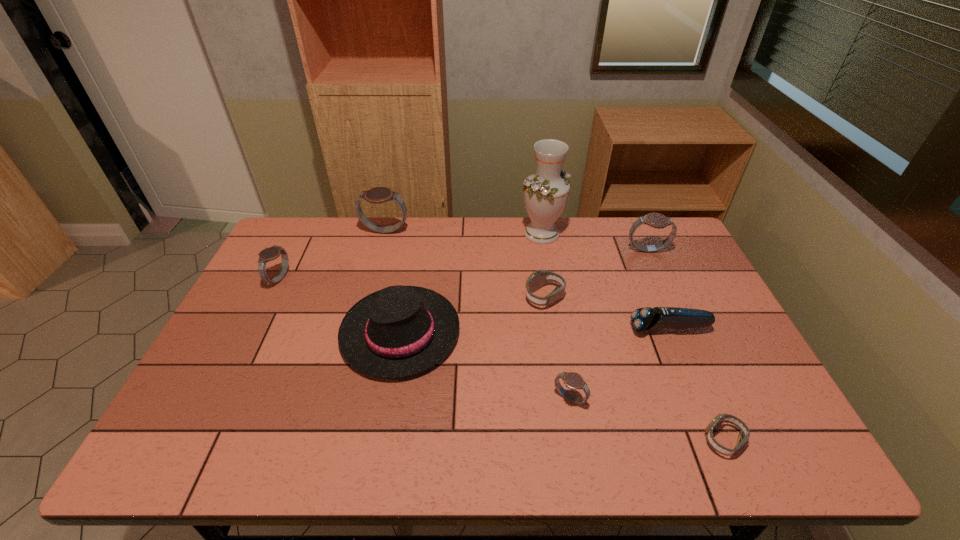
Find the location of `electric shaver`. electric shaver is located at coordinates (243, 412).

In order to click on the second nearest object in this screenshot , I will do `click(243, 412)`.

Locate an element on the screen. Image resolution: width=960 pixels, height=540 pixels. the fifth farthest watch is located at coordinates (243, 412).

At what (x,y) coordinates should I click in order to perform the action: click on the nearer white watch. Please return your answer as a coordinate pair (x, y). The height and width of the screenshot is (540, 960). Looking at the image, I should click on (243, 412).

Where is `the shortest object`? The image size is (960, 540). the shortest object is located at coordinates (243, 412).

Image resolution: width=960 pixels, height=540 pixels. Identify the location of vacant space situated on the left of the vase. (460, 233).

Locate an element on the screen. The width and height of the screenshot is (960, 540). free space located on the right of the biggest gray watch is located at coordinates (485, 231).

Where is `vacant point located on the left of the fifth nearest watch`? vacant point located on the left of the fifth nearest watch is located at coordinates (593, 251).

Locate an element on the screen. The image size is (960, 540). free space located 0.050m on the front of the dress hat is located at coordinates (389, 401).

What are the coordinates of `free location located on the right of the third tallest watch` in the screenshot? It's located at (308, 279).